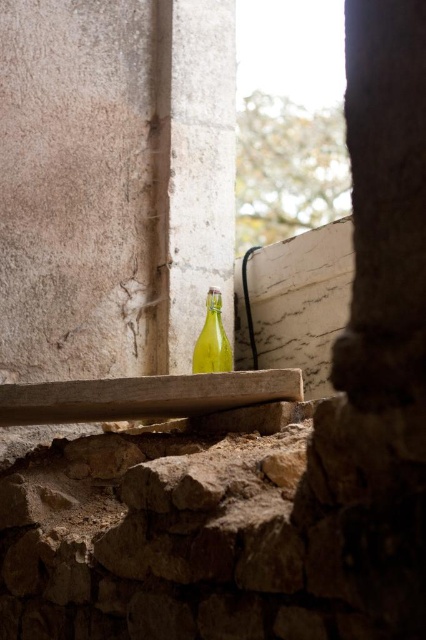
You are a delivery person who needs to place a small package on the smooth wooden plank at center. However, there is already a green glass bottle at center on it. Can you place the package to the right of the bottle without moving it?

The smooth wooden plank at center is to the left of the green glass bottle at center, so placing the package to the right of the bottle would still be on the plank. Yes, you can place the package to the right of the green glass bottle at center on the smooth wooden plank at center.

You are an interior designer assessing the space through the window. You need to place a new decorative item on the smooth wooden plank at center. Considering the size of the plank and the green glass bottle at center, will there be enough space for the new item?

The smooth wooden plank at center has a larger size compared to green glass bottle at center, so there should be enough space left on the plank to place a new decorative item alongside the green glass bottle at center.

You are a delivery person who needs to place a heavy box on the smooth wooden plank at center. However, there is a green glass bottle at center on it. Can you place the box there without moving the bottle?

The smooth wooden plank at center is located below the green glass bottle at center, meaning the bottle is resting on the plank. Since the bottle is already on the plank, placing a heavy box there would likely displace or break the bottle, so it is not advisable to place the box without moving the bottle.